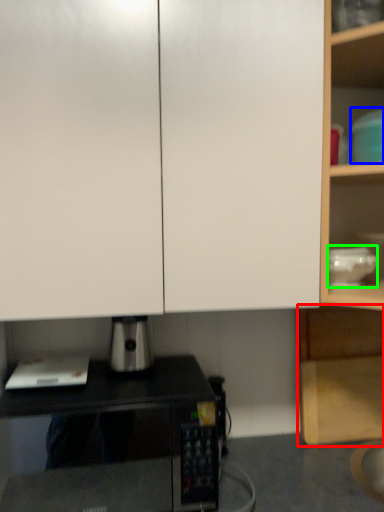
Question: Which object is the farthest from cabinetry (highlighted by a red box)? Choose among these: appliance (highlighted by a blue box) or appliance (highlighted by a green box).

Choices:
 (A) appliance
 (B) appliance

Answer: (A)